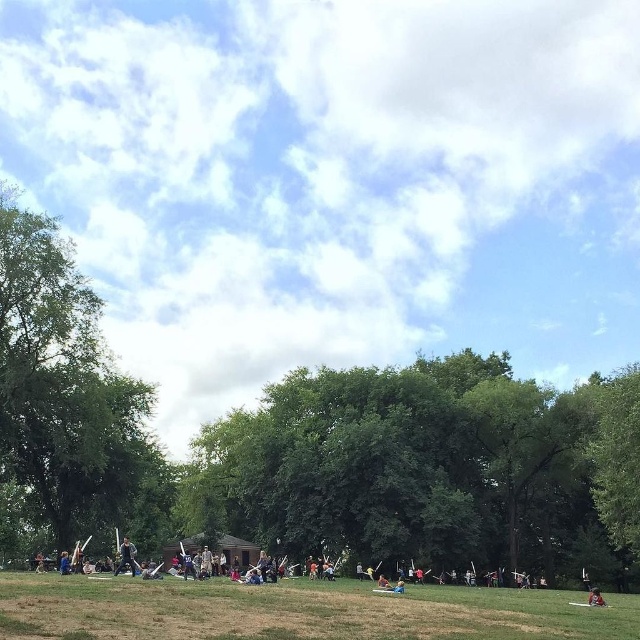
Question: Is green leafy tree at left below dark gray fabric person at center?

Choices:
 (A) yes
 (B) no

Answer: (B)

Question: Which point is farther from the camera taking this photo?

Choices:
 (A) (592, 604)
 (B) (141, 588)
 (C) (134, 572)
 (D) (44, 296)

Answer: (D)

Question: Which point appears farthest from the camera in this image?

Choices:
 (A) (294, 515)
 (B) (83, 618)
 (C) (595, 600)
 (D) (10, 499)

Answer: (D)

Question: Which of these objects is positioned closest to the dark gray fabric person at center?

Choices:
 (A) red fabric person at lower right
 (B) green grassy field at center

Answer: (B)

Question: Does green leafy tree at left lie behind green grassy field at center?

Choices:
 (A) no
 (B) yes

Answer: (B)

Question: Does green leafy tree at left come behind dark gray fabric person at center?

Choices:
 (A) no
 (B) yes

Answer: (B)